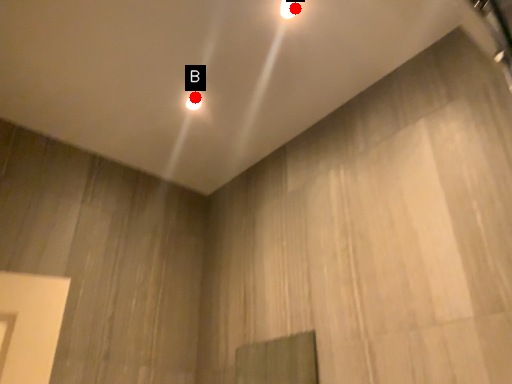
Question: Two points are circled on the image, labeled by A and B beside each circle. Among these points, which one is farthest from the camera?

Choices:
 (A) A is further
 (B) B is further

Answer: (B)